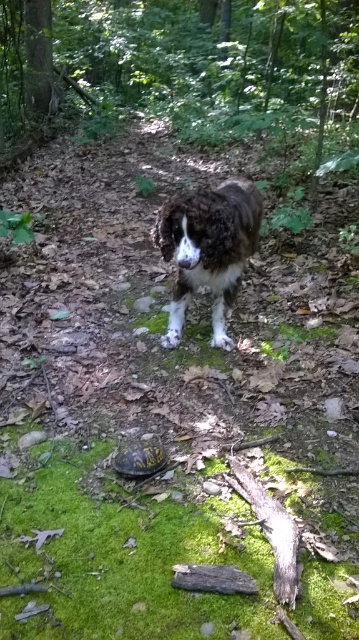
Consider the image. Measure the distance from green mossy forest at center to brown fuzzy dog at center.

green mossy forest at center is 19.18 feet from brown fuzzy dog at center.

Who is positioned more to the right, green mossy forest at center or brown fuzzy dog at center?

From the viewer's perspective, brown fuzzy dog at center appears more on the right side.

Is point (2, 20) positioned after point (221, 326)?

Yes.

The image size is (359, 640). Find the location of `green mossy forest at center`. green mossy forest at center is located at coordinates (187, 72).

Does brown fuzzy dog at center have a greater height compared to yellow-brown textured shell at center?

Yes.

From the picture: Is brown fuzzy dog at center shorter than yellow-brown textured shell at center?

Incorrect, brown fuzzy dog at center's height does not fall short of yellow-brown textured shell at center's.

What do you see at coordinates (207, 248) in the screenshot? I see `brown fuzzy dog at center` at bounding box center [207, 248].

Locate an element on the screen. brown fuzzy dog at center is located at coordinates (207, 248).

Which is more to the left, green mossy forest at center or yellow-brown textured shell at center?

green mossy forest at center

Does green mossy forest at center have a lesser width compared to yellow-brown textured shell at center?

In fact, green mossy forest at center might be wider than yellow-brown textured shell at center.

Who is more distant from viewer, (16,113) or (136,477)?

The point (16,113) is more distant.

Where is `green mossy forest at center`? green mossy forest at center is located at coordinates (187, 72).